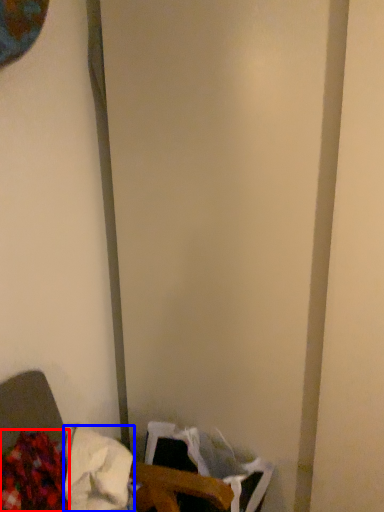
Question: Which of the following is the farthest to the observer, waste (highlighted by a red box) or waste (highlighted by a blue box)?

Choices:
 (A) waste
 (B) waste

Answer: (B)